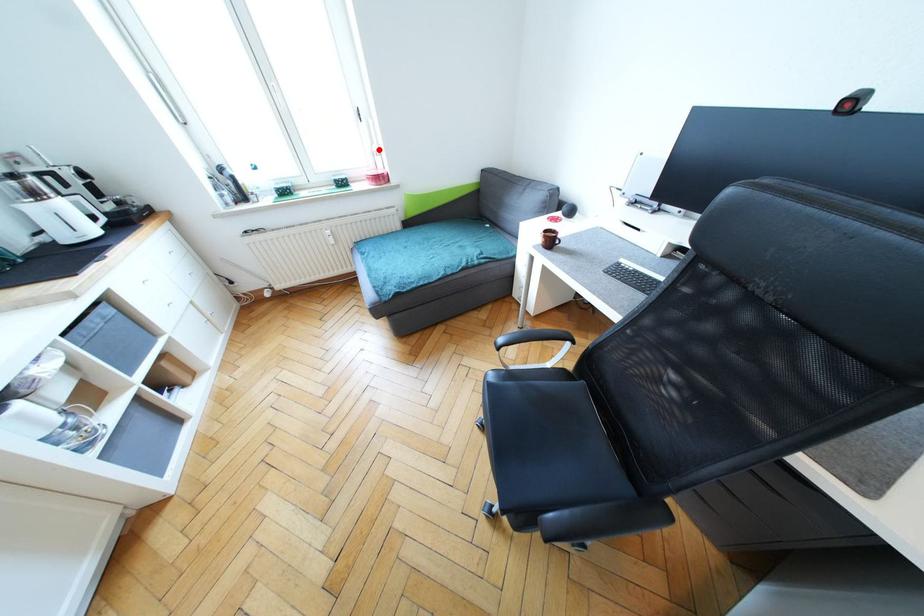
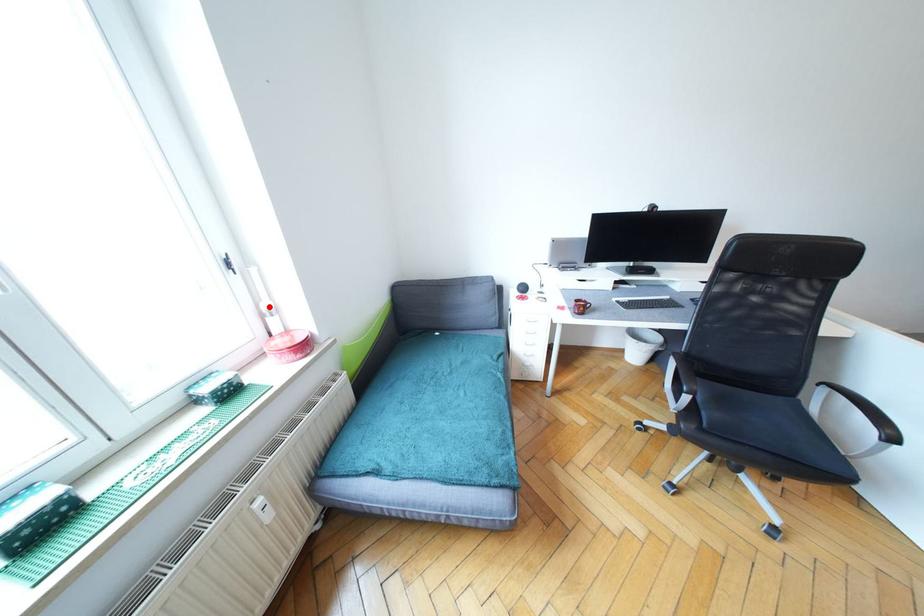
I am providing you with two images of the same scene from different viewpoints. A red point is marked on the first image and another point is marked on the second image. Are the points marked in image1 and image2 representing the same 3D position?

Yes